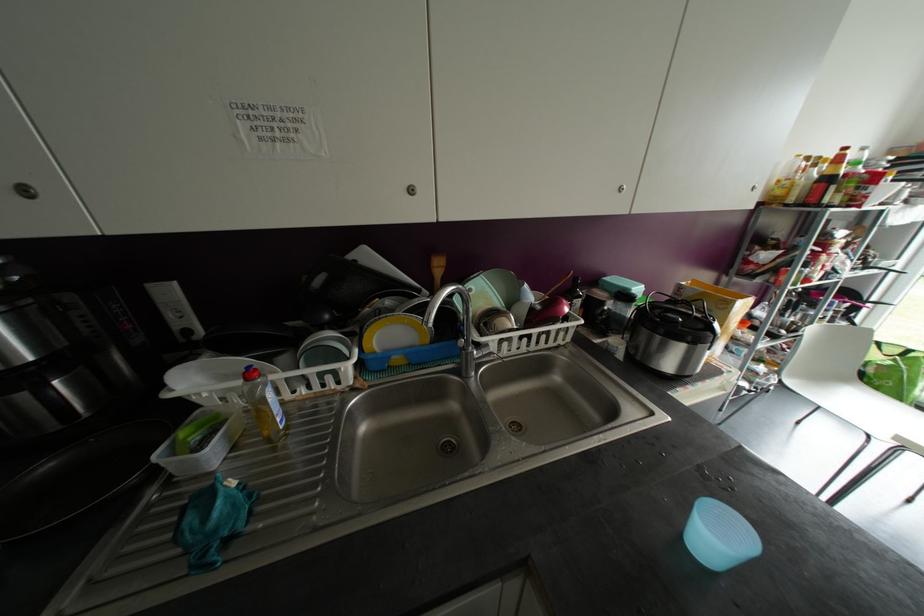
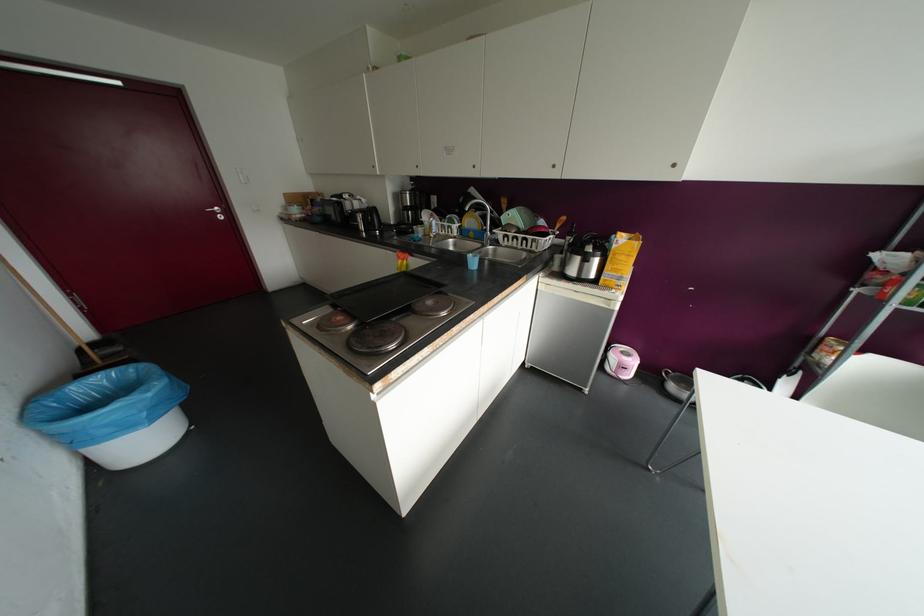
Find the pixel in the second image that matches (619,188) in the first image.

(553, 166)